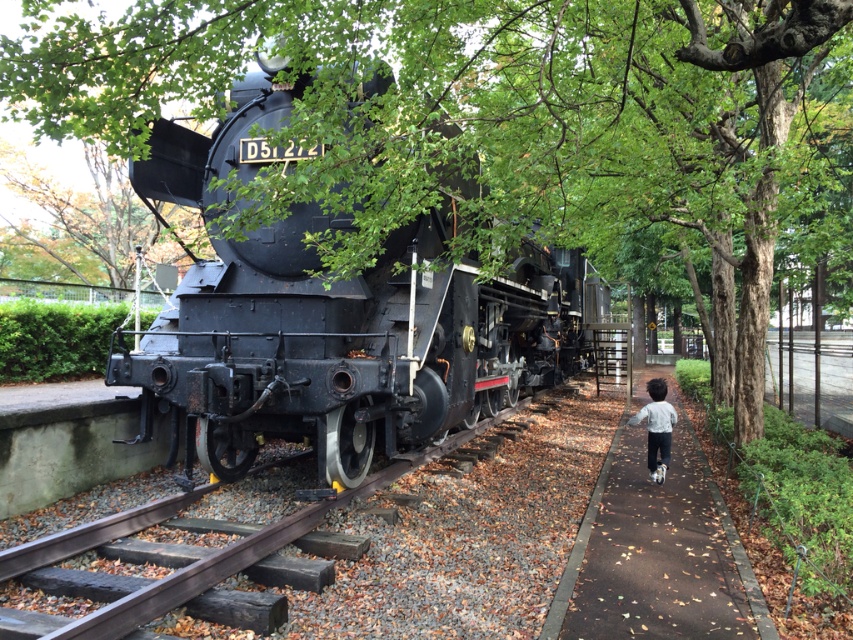
Does brown asphalt path at lower right have a greater height compared to light gray fleece jacket at lower right?

No.

Does brown asphalt path at lower right have a smaller size compared to light gray fleece jacket at lower right?

No.

Describe the element at coordinates (657, 554) in the screenshot. I see `brown asphalt path at lower right` at that location.

The image size is (853, 640). Find the location of `brown asphalt path at lower right`. brown asphalt path at lower right is located at coordinates (657, 554).

Which is below, matte black locomotive at center or light gray fleece jacket at lower right?

light gray fleece jacket at lower right is lower down.

Is point (190, 154) positioned before point (653, 378)?

Yes, point (190, 154) is closer to viewer.

Is point (520, 296) in front of point (651, 456)?

No.

This screenshot has width=853, height=640. Identify the location of matte black locomotive at center. (334, 314).

Is matte black locomotive at center below brown asphalt path at lower right?

Incorrect, matte black locomotive at center is not positioned below brown asphalt path at lower right.

Can you confirm if matte black locomotive at center is positioned to the right of brown asphalt path at lower right?

Incorrect, matte black locomotive at center is not on the right side of brown asphalt path at lower right.

Is point (300, 268) positioned before point (706, 554)?

No, (300, 268) is further to viewer.

Locate an element on the screen. The width and height of the screenshot is (853, 640). matte black locomotive at center is located at coordinates (334, 314).